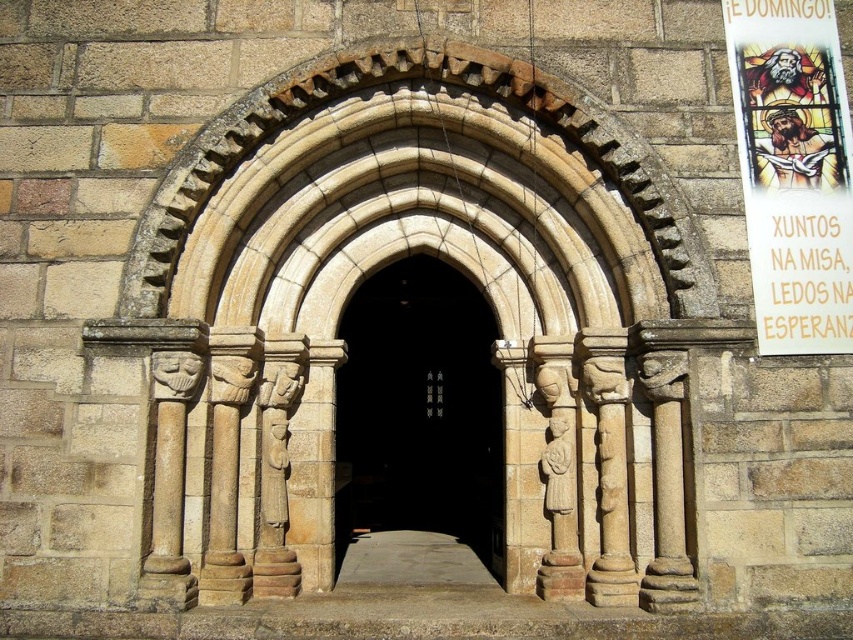
Is smooth stone arch at center positioned in front of white paper poster at upper right?

No, smooth stone arch at center is further to the viewer.

Which is below, smooth stone arch at center or white paper poster at upper right?

smooth stone arch at center

Who is more distant from viewer, (498, 433) or (763, 13)?

Positioned behind is point (498, 433).

Find the location of a particular element. The height and width of the screenshot is (640, 853). smooth stone arch at center is located at coordinates (419, 410).